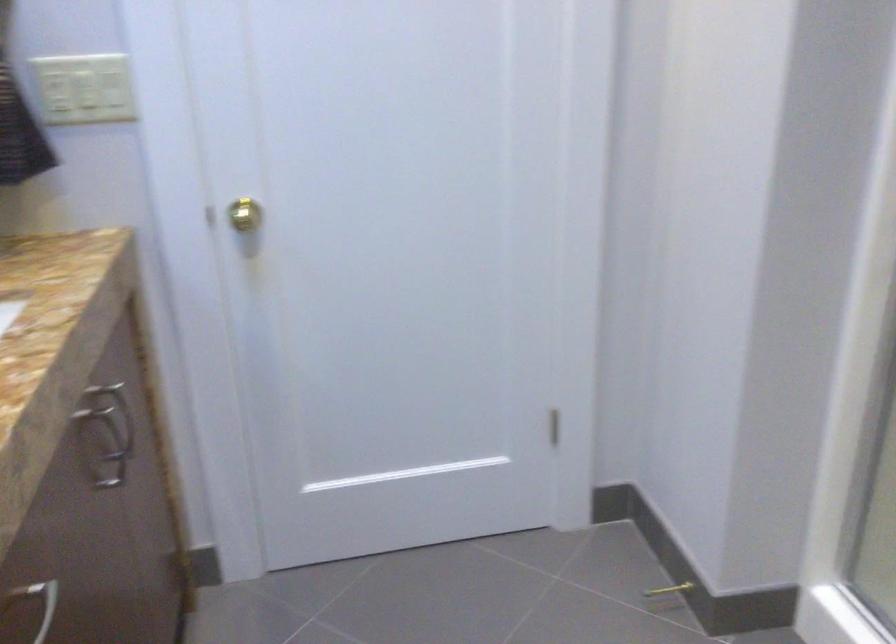
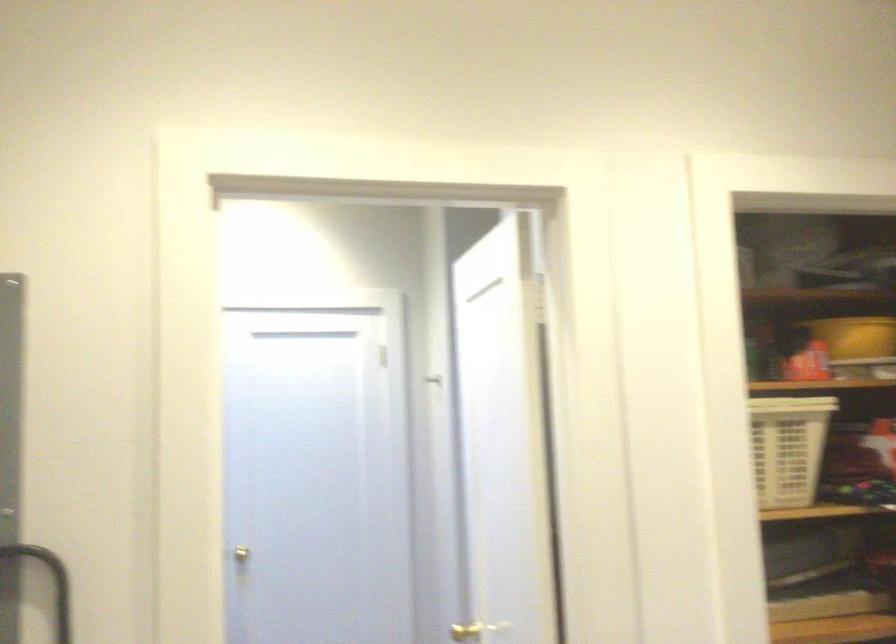
Question: I am providing you with two images of the same scene from different viewpoints. After the viewpoint changes to image2, which objects are now occluded?

Choices:
 (A) light switch
 (B) blue bottle cap
 (C) yellow container
 (D) white laundry basket

Answer: (A)